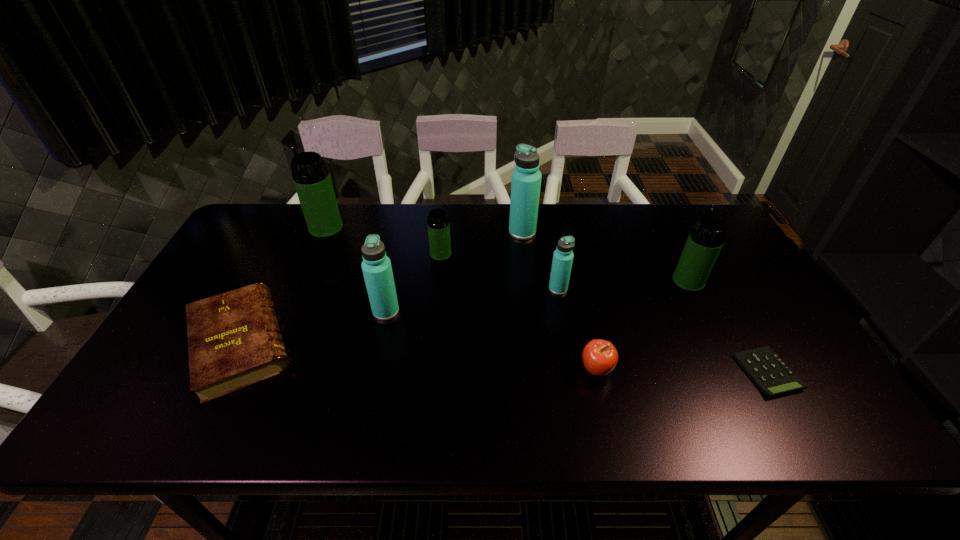
This screenshot has height=540, width=960. Identify the location of thermos bottle object that ranks as the fifth closest to the biggest green thermos bottle. (707, 237).

Select which green thermos bottle is the closest to the fifth thermos bottle from left to right. Please provide its 2D coordinates. Your answer should be formatted as a tuple, i.e. [(x, y)], where the tuple contains the x and y coordinates of a point satisfying the conditions above.

[(438, 225)]

Locate an element on the screen. The image size is (960, 540). green thermos bottle that is the closest one to the farthest aqua thermos bottle is located at coordinates (438, 225).

Select which aqua thermos bottle appears as the second closest to the farthest green thermos bottle. Please provide its 2D coordinates. Your answer should be formatted as a tuple, i.e. [(x, y)], where the tuple contains the x and y coordinates of a point satisfying the conditions above.

[(526, 179)]

Where is `aqua thermos bottle that is the second closest to the biggest green thermos bottle`? aqua thermos bottle that is the second closest to the biggest green thermos bottle is located at coordinates (526, 179).

I want to click on free space in the image that satisfies the following two spatial constraints: 1. on the front side of the second shortest object; 2. on the right side of the shortest object, so click(227, 373).

The height and width of the screenshot is (540, 960). Find the location of `free space that satisfies the following two spatial constraints: 1. on the back side of the hardback book; 2. on the left side of the fifth thermos bottle from right to left`. free space that satisfies the following two spatial constraints: 1. on the back side of the hardback book; 2. on the left side of the fifth thermos bottle from right to left is located at coordinates (257, 311).

Identify the location of free point that satisfies the following two spatial constraints: 1. from the spout of the second smallest green thermos bottle; 2. from the spout of the farthest green thermos bottle. This screenshot has width=960, height=540. (661, 228).

The image size is (960, 540). I want to click on free point that satisfies the following two spatial constraints: 1. from the spout of the fourth object from left to right; 2. on the right side of the apple, so 429,369.

Locate an element on the screen. free spot that satisfies the following two spatial constraints: 1. from the spout of the calculator; 2. on the left side of the third farthest thermos bottle is located at coordinates (429, 373).